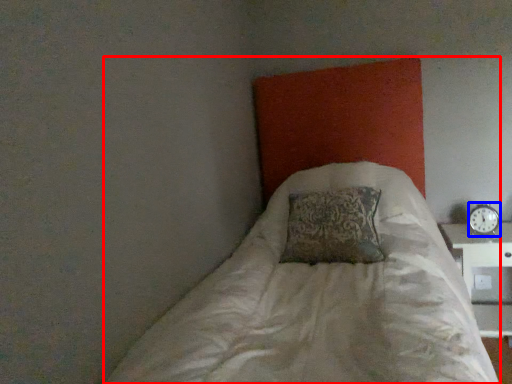
Question: Among these objects, which one is nearest to the camera, bed (highlighted by a red box) or clock (highlighted by a blue box)?

Choices:
 (A) bed
 (B) clock

Answer: (A)